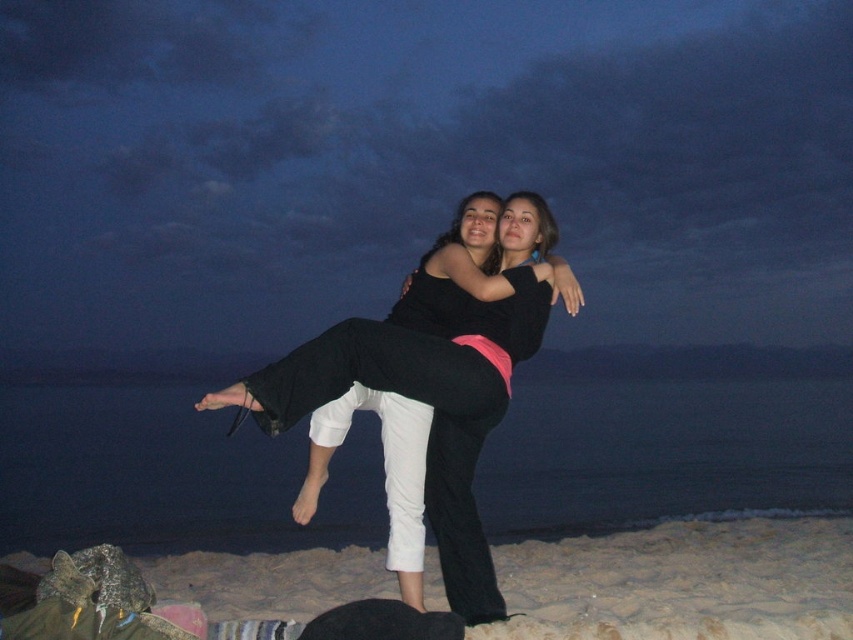
Can you confirm if sandy at lower center is positioned to the right of black matte pants at center?

Correct, you'll find sandy at lower center to the right of black matte pants at center.

Who is shorter, sandy at lower center or black matte pants at center?

sandy at lower center

I want to click on sandy at lower center, so click(683, 580).